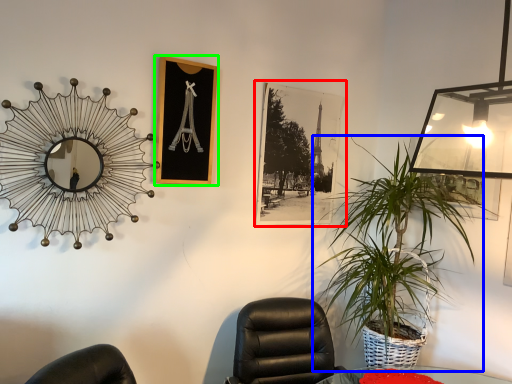
Question: Considering the real-world distances, which object is farthest from picture frame (highlighted by a red box)? houseplant (highlighted by a blue box) or picture frame (highlighted by a green box)?

Choices:
 (A) houseplant
 (B) picture frame

Answer: (B)